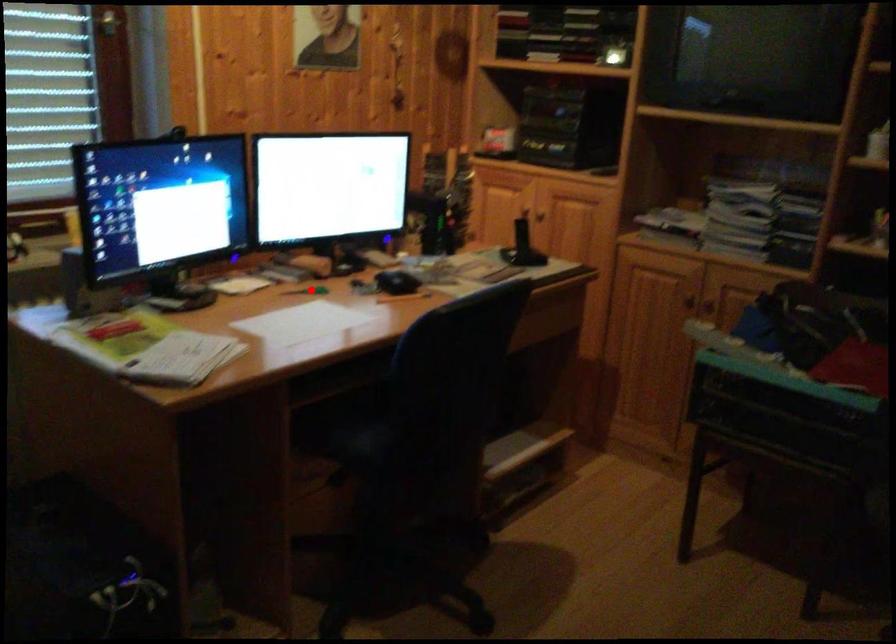
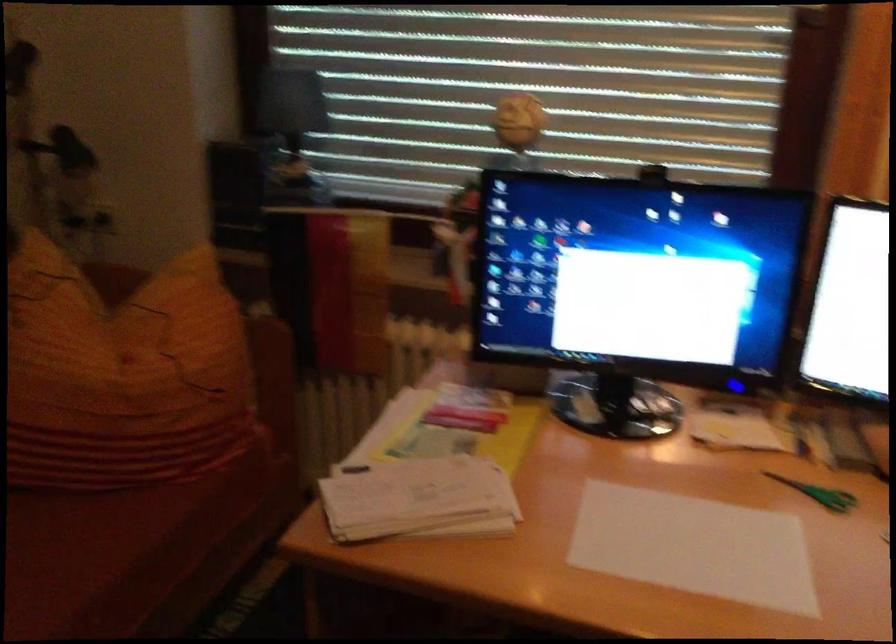
Where in the second image is the point corresponding to the highlighted location from the first image?

(819, 493)